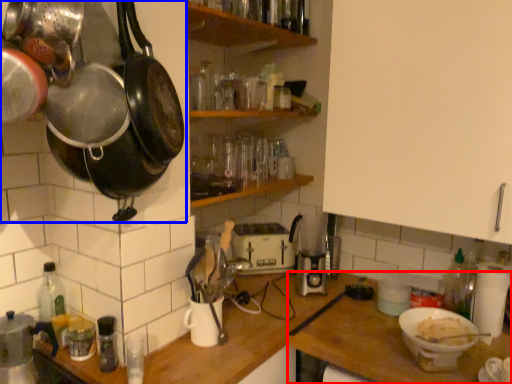
Question: Which of the following is the farthest to the observer, table (highlighted by a red box) or frying pan (highlighted by a blue box)?

Choices:
 (A) table
 (B) frying pan

Answer: (A)